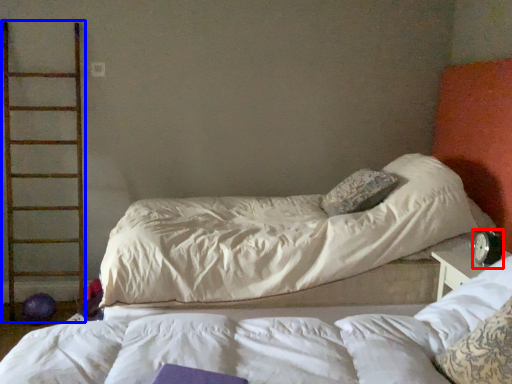
Question: Among these objects, which one is nearest to the camera, alarm clock (highlighted by a red box) or ladder (highlighted by a blue box)?

Choices:
 (A) alarm clock
 (B) ladder

Answer: (A)